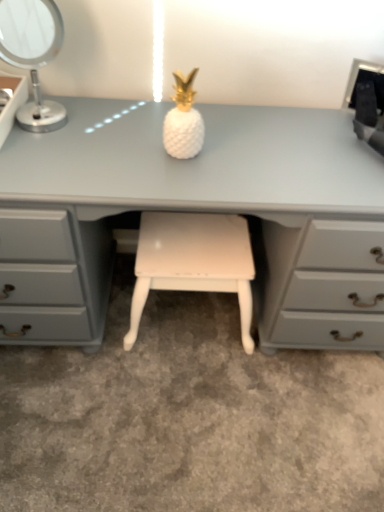
Where is `vacant space that is to the left of black plastic desktop computer at upper right`? vacant space that is to the left of black plastic desktop computer at upper right is located at coordinates (299, 124).